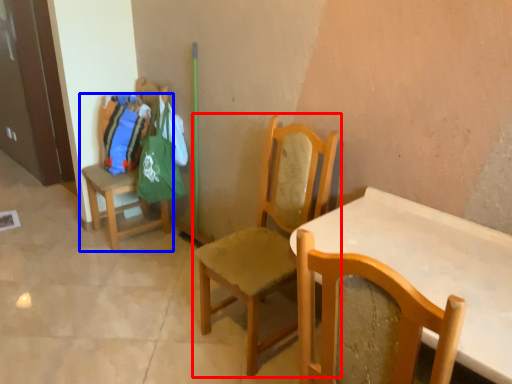
Question: Which point is closer to the camera, chair (highlighted by a red box) or chair (highlighted by a blue box)?

Choices:
 (A) chair
 (B) chair

Answer: (A)